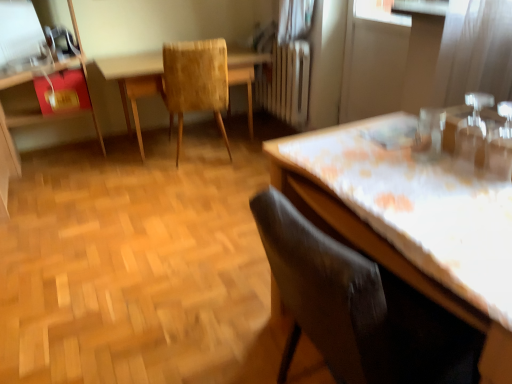
Question: In terms of size, does wooden textured table at center appear bigger or smaller than white floral tablecloth at right?

Choices:
 (A) small
 (B) big

Answer: (B)

Question: Relative to white floral tablecloth at right, is wooden textured table at center in front or behind?

Choices:
 (A) front
 (B) behind

Answer: (B)

Question: Which is farther from the transparent plastic screen door at upper right?

Choices:
 (A) matte red dresser at left
 (B) textured beige chair at center, which is the 1th chair in left-to-right order
 (C) transparent plastic window screen at upper left
 (D) wooden textured table at center
 (E) velvet dark brown chair at lower right, positioned as the 2th chair in back-to-front order

Answer: (C)

Question: Which object is the closest to the matte red dresser at left?

Choices:
 (A) transparent plastic window screen at upper left
 (B) wooden textured table at center
 (C) textured beige chair at center, which is the 1th chair in left-to-right order
 (D) velvet dark brown chair at lower right, acting as the 1th chair starting from the front
 (E) transparent plastic screen door at upper right

Answer: (A)